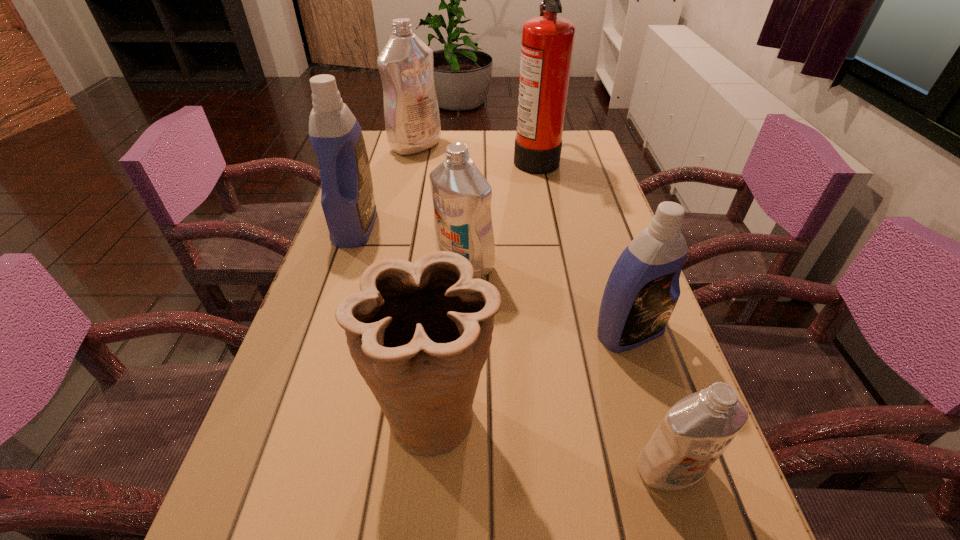
What are the coordinates of `the third closest detergent to the smallest white detergent` in the screenshot? It's located at (347, 197).

Locate which detergent ranks second in proximity to the smaller blue detergent. Please provide its 2D coordinates. Your answer should be formatted as a tuple, i.e. [(x, y)], where the tuple contains the x and y coordinates of a point satisfying the conditions above.

[(461, 195)]

This screenshot has width=960, height=540. Find the location of `the second closest white detergent to the shortest detergent`. the second closest white detergent to the shortest detergent is located at coordinates click(x=412, y=120).

Where is `white detergent that is the third closest to the urn`? Image resolution: width=960 pixels, height=540 pixels. white detergent that is the third closest to the urn is located at coordinates (412, 120).

The width and height of the screenshot is (960, 540). What are the coordinates of `blue detergent that is the second closest to the red fire extinguisher` in the screenshot? It's located at (643, 288).

You are a GUI agent. You are given a task and a screenshot of the screen. Output one action in this format:
    pyautogui.click(x=<x>, y=<y>)
    Task: Click on the vacant space that satisfies the following two spatial constraints: 1. on the front side of the second white detergent from right to left; 2. on the right side of the rightmost white detergent
    Image resolution: width=960 pixels, height=540 pixels.
    Given the screenshot: What is the action you would take?
    pyautogui.click(x=457, y=469)

Identify the location of free space that satisfies the following two spatial constraints: 1. on the back side of the leftmost white detergent; 2. on the left side of the bigger blue detergent. This screenshot has width=960, height=540. (384, 146).

At what (x,y) coordinates should I click in order to perform the action: click on free spot that satisfies the following two spatial constraints: 1. on the front side of the second white detergent from right to left; 2. on the left side of the shortest detergent. Please return your answer as a coordinate pair (x, y). The image size is (960, 540). Looking at the image, I should click on (457, 469).